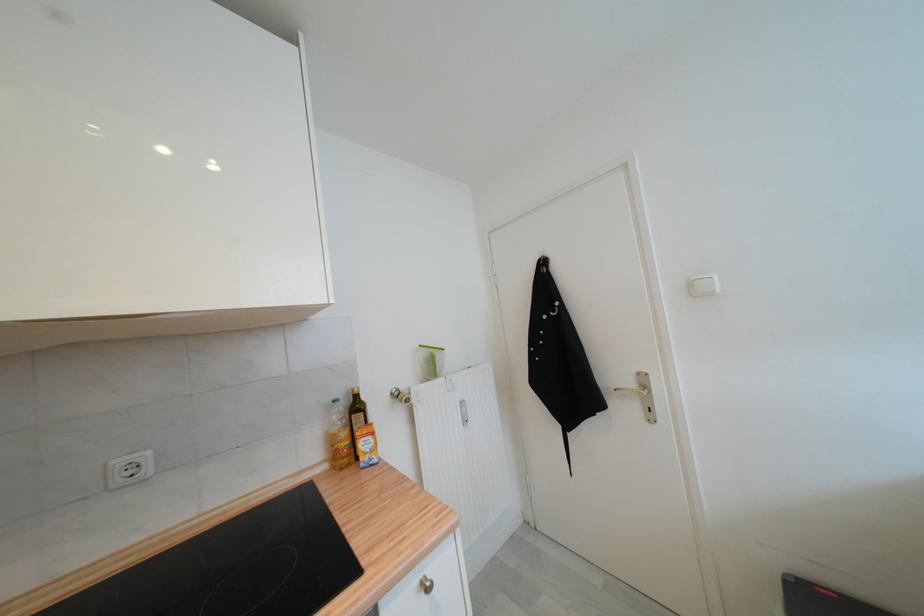
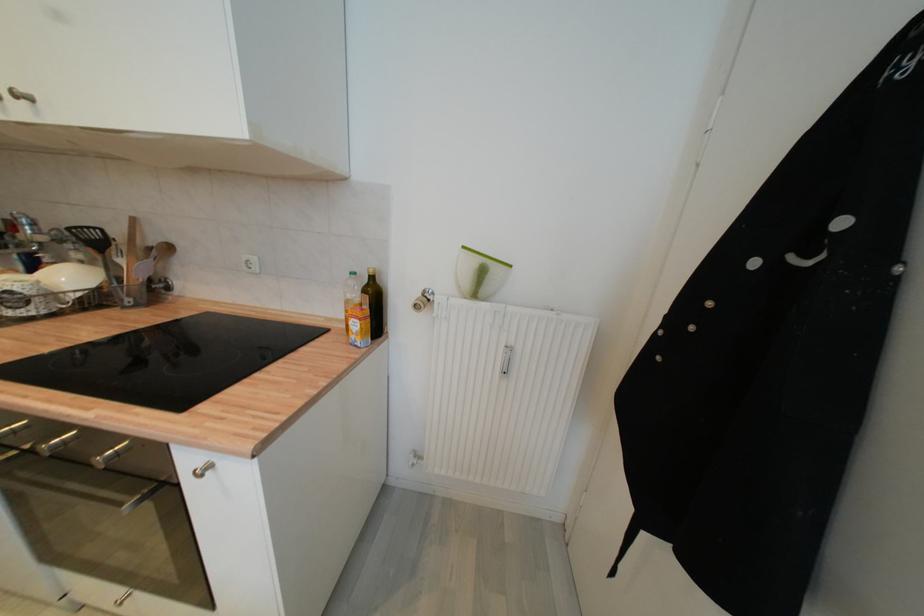
The first image is from the beginning of the video and the second image is from the end. How did the camera likely rotate when shooting the video?

The camera's rotation is toward left-down.